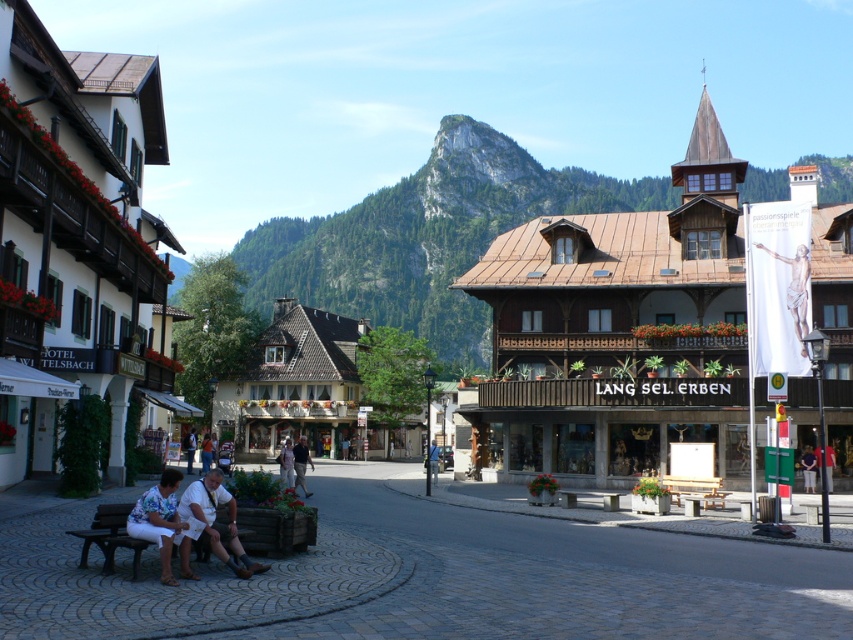
Is wooden bench at lower left positioned before wooden bench at center?

That is True.

Who is positioned more to the right, wooden bench at lower left or wooden bench at center?

wooden bench at center

The image size is (853, 640). I want to click on wooden bench at lower left, so click(x=109, y=536).

Between white cotton pants at lower left and light brown leather jacket at center, which one appears on the left side from the viewer's perspective?

From the viewer's perspective, light brown leather jacket at center appears more on the left side.

Who is taller, white cotton pants at lower left or light brown leather jacket at center?

light brown leather jacket at center

Is point (186, 577) closer to viewer compared to point (279, 452)?

Yes, point (186, 577) is closer to viewer.

Where is `white cotton pants at lower left`? white cotton pants at lower left is located at coordinates (196, 528).

Is point (769, 182) behind point (801, 460)?

Yes, point (769, 182) is behind point (801, 460).

Between rugged rock at center and green fabric shirt at center, which one appears on the right side from the viewer's perspective?

From the viewer's perspective, green fabric shirt at center appears more on the right side.

Does point (405, 300) lie in front of point (811, 456)?

No, it is not.

This screenshot has height=640, width=853. Identify the location of rugged rock at center. (428, 237).